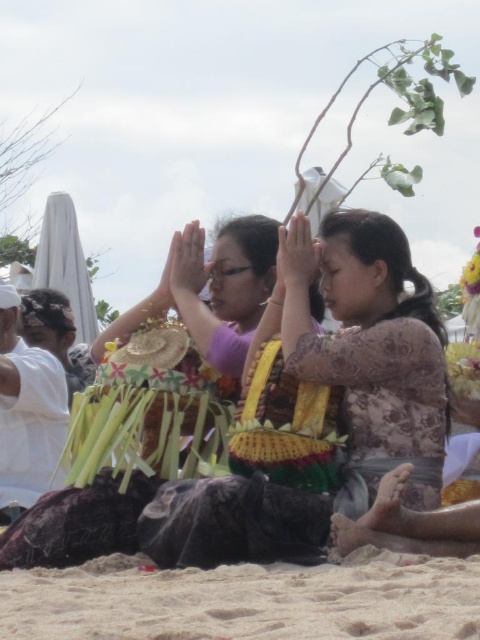
This screenshot has height=640, width=480. Describe the element at coordinates (245, 600) in the screenshot. I see `sandy beach at lower center` at that location.

Can you confirm if sandy beach at lower center is shorter than patterned silk dress at center?

Correct, sandy beach at lower center is not as tall as patterned silk dress at center.

Between point (67, 596) and point (295, 356), which one is positioned in front?

Positioned in front is point (67, 596).

Find the location of a particular element. The height and width of the screenshot is (640, 480). sandy beach at lower center is located at coordinates (245, 600).